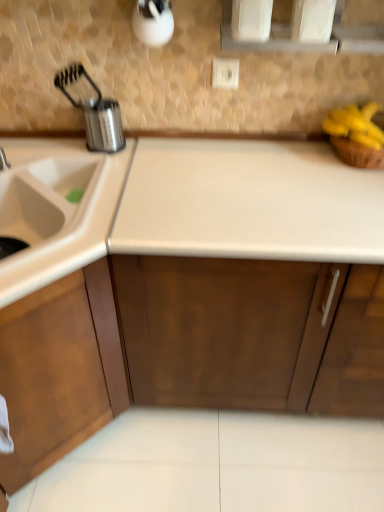
Question: In terms of size, does white laminate countertop at center appear bigger or smaller than wooden cabinet at left?

Choices:
 (A) big
 (B) small

Answer: (A)

Question: From the image's perspective, is white laminate countertop at center located above or below wooden cabinet at left?

Choices:
 (A) above
 (B) below

Answer: (A)

Question: Which object is the farthest from the white laminate countertop at center?

Choices:
 (A) yellow matte bananas at upper right
 (B) metallic silver canister at upper left
 (C) white plastic electric outlet at upper center
 (D) brushed metal faucet at left
 (E) wooden cabinet at left

Answer: (C)

Question: Which object is positioned farthest from the yellow matte bananas at upper right?

Choices:
 (A) metallic silver canister at upper left
 (B) brushed metal faucet at left
 (C) wooden cabinet at left
 (D) white plastic electric outlet at upper center
 (E) white laminate countertop at center

Answer: (E)